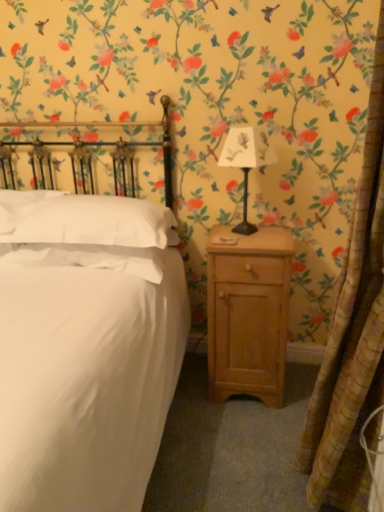
Question: From a real-world perspective, is white soft pillow at left, the 2th pillow when ordered from left to right, on metallic black lamp at center-right?

Choices:
 (A) no
 (B) yes

Answer: (A)

Question: Is the depth of white soft pillow at left, the 2th pillow when ordered from left to right, less than that of metallic black lamp at center-right?

Choices:
 (A) no
 (B) yes

Answer: (B)

Question: Can you confirm if white soft pillow at left, which is the first pillow from right to left, is wider than metallic black lamp at center-right?

Choices:
 (A) yes
 (B) no

Answer: (A)

Question: Can you confirm if white soft pillow at left, which is the first pillow from right to left, is bigger than metallic black lamp at center-right?

Choices:
 (A) yes
 (B) no

Answer: (A)

Question: Is white soft pillow at left, the 2th pillow when ordered from left to right, oriented away from metallic black lamp at center-right?

Choices:
 (A) no
 (B) yes

Answer: (A)

Question: Considering the positions of white soft pillow at upper left, marked as the 1th pillow in a left-to-right arrangement, and textured beige curtain at right in the image, is white soft pillow at upper left, marked as the 1th pillow in a left-to-right arrangement, bigger or smaller than textured beige curtain at right?

Choices:
 (A) big
 (B) small

Answer: (B)

Question: Would you say white soft pillow at upper left, the second pillow from the right, is to the left or to the right of textured beige curtain at right in the picture?

Choices:
 (A) left
 (B) right

Answer: (A)

Question: Is white soft pillow at upper left, the second pillow from the right, inside the boundaries of textured beige curtain at right, or outside?

Choices:
 (A) inside
 (B) outside

Answer: (B)

Question: Relative to textured beige curtain at right, is white soft pillow at upper left, marked as the 1th pillow in a left-to-right arrangement, in front or behind?

Choices:
 (A) front
 (B) behind

Answer: (B)

Question: From a real-world perspective, is white matte bed at center above or below light wood nightstand at right?

Choices:
 (A) above
 (B) below

Answer: (A)

Question: Looking at the image, does white matte bed at center seem bigger or smaller compared to light wood nightstand at right?

Choices:
 (A) small
 (B) big

Answer: (B)

Question: Looking at their shapes, would you say white matte bed at center is wider or thinner than light wood nightstand at right?

Choices:
 (A) thin
 (B) wide

Answer: (B)

Question: From the image's perspective, is white matte bed at center above or below light wood nightstand at right?

Choices:
 (A) above
 (B) below

Answer: (A)

Question: Which is correct: white soft pillow at upper left, marked as the 1th pillow in a left-to-right arrangement, is inside light wood nightstand at right, or outside of it?

Choices:
 (A) outside
 (B) inside

Answer: (A)

Question: From a real-world perspective, is white soft pillow at upper left, the second pillow from the right, physically located above or below light wood nightstand at right?

Choices:
 (A) below
 (B) above

Answer: (B)